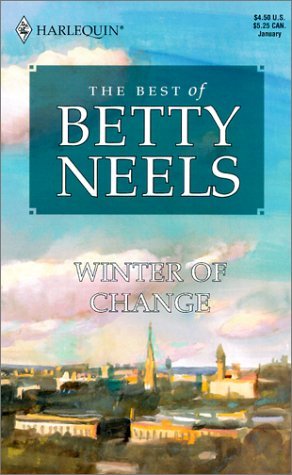
This screenshot has width=292, height=475. In order to click on arched doorways in this screenshot , I will do `click(232, 449)`.